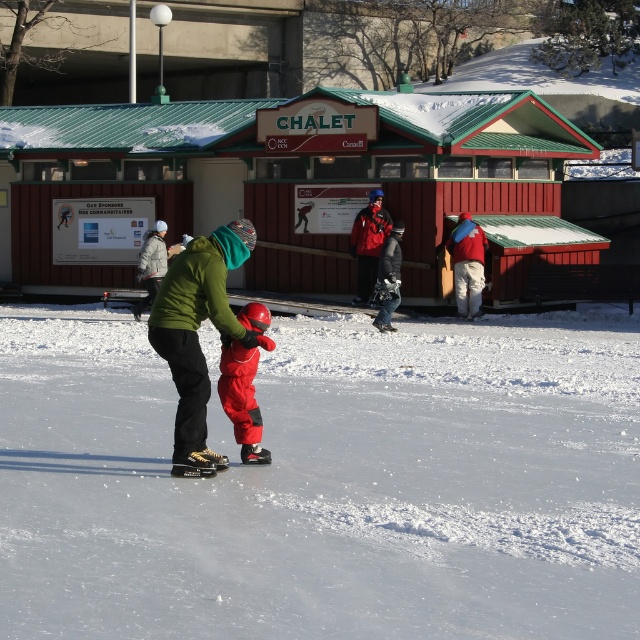
Is green fleece jacket at center thinner than matte red snowsuit at center?

No, green fleece jacket at center is not thinner than matte red snowsuit at center.

Is green fleece jacket at center to the right of matte red snowsuit at center from the viewer's perspective?

In fact, green fleece jacket at center is to the left of matte red snowsuit at center.

Identify the location of green fleece jacket at center. (196, 333).

Identify the location of green fleece jacket at center. The width and height of the screenshot is (640, 640). (196, 333).

Can you confirm if matte red snowsuit at center is smaller than matte black snowsuit at center?

Yes.

Is matte red snowsuit at center to the right of matte black snowsuit at center from the viewer's perspective?

In fact, matte red snowsuit at center is to the left of matte black snowsuit at center.

This screenshot has width=640, height=640. I want to click on matte red snowsuit at center, so click(241, 397).

Locate an element on the screen. The width and height of the screenshot is (640, 640). matte red snowsuit at center is located at coordinates (241, 397).

Who is positioned more to the left, white smooth ice at center or red matte jacket at center?

From the viewer's perspective, white smooth ice at center appears more on the left side.

Is white smooth ice at center smaller than red matte jacket at center?

No, white smooth ice at center is not smaller than red matte jacket at center.

Is point (557, 342) farther from camera compared to point (356, 228)?

No, (557, 342) is closer to viewer.

Locate an element on the screen. white smooth ice at center is located at coordinates (324, 481).